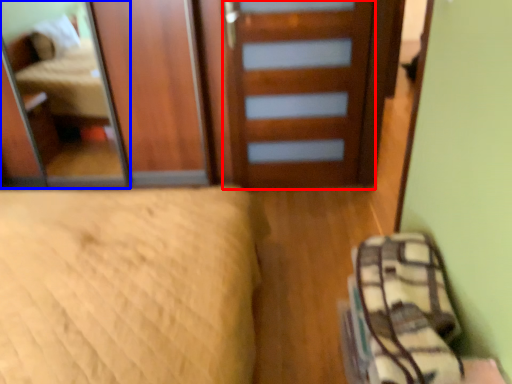
Question: Which point is further to the camera, door (highlighted by a red box) or mirror (highlighted by a blue box)?

Choices:
 (A) door
 (B) mirror

Answer: (B)